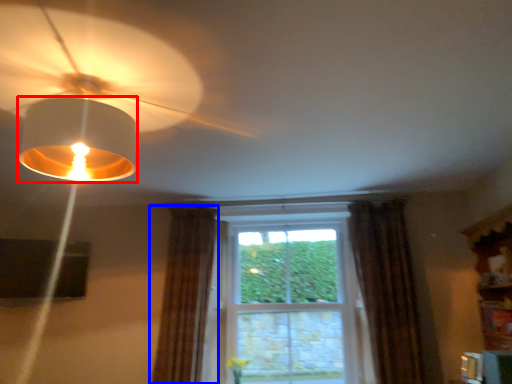
Question: Which object is closer to the camera taking this photo, lamp (highlighted by a red box) or curtain (highlighted by a blue box)?

Choices:
 (A) lamp
 (B) curtain

Answer: (A)